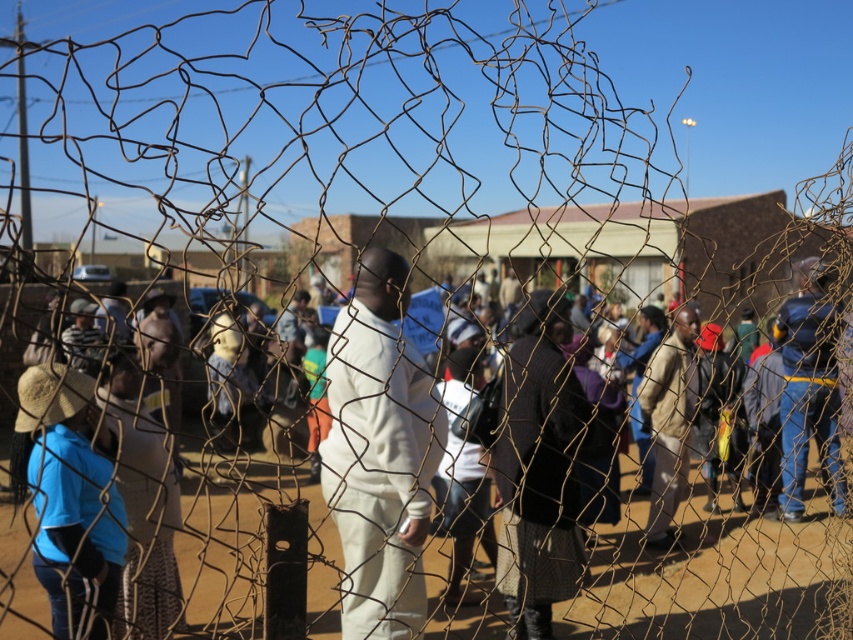
Question: Does blue denim jeans at right appear over light brown leather jacket at center?

Choices:
 (A) no
 (B) yes

Answer: (B)

Question: Among these objects, which one is farthest from the camera?

Choices:
 (A) white matte pants at center
 (B) dark brown textured coat at center
 (C) blue denim jeans at right

Answer: (C)

Question: Which of these objects is positioned closest to the blue denim jeans at right?

Choices:
 (A) wire mesh fence at center
 (B) dark brown textured coat at center
 (C) white matte pants at center
 (D) light brown leather jacket at center

Answer: (D)

Question: Can you confirm if wire mesh fence at center is positioned to the left of dark brown textured coat at center?

Choices:
 (A) no
 (B) yes

Answer: (A)

Question: Is dark brown textured coat at center smaller than blue denim jeans at right?

Choices:
 (A) no
 (B) yes

Answer: (B)

Question: Based on their relative distances, which object is nearer to the dark brown textured coat at center?

Choices:
 (A) wire mesh fence at center
 (B) light brown leather jacket at center

Answer: (A)